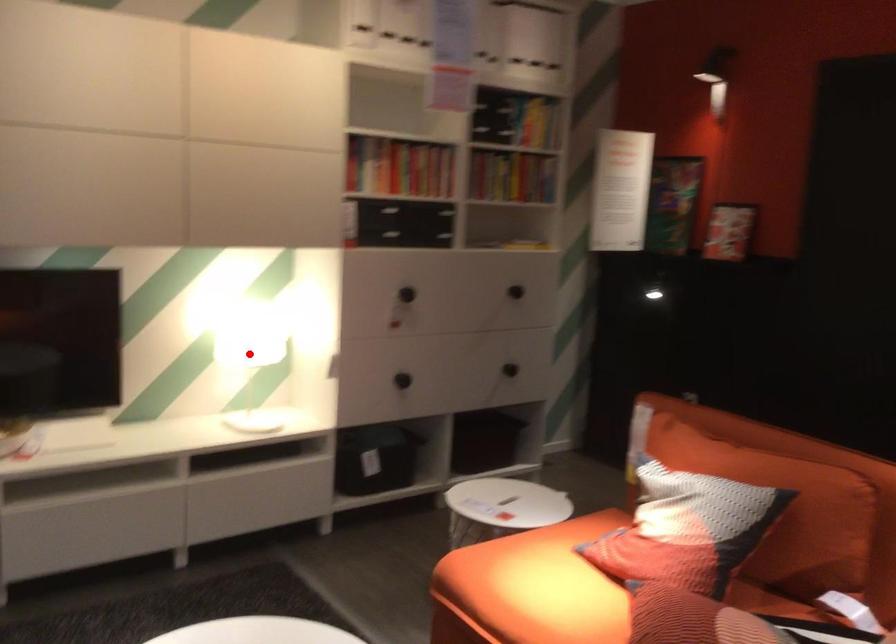
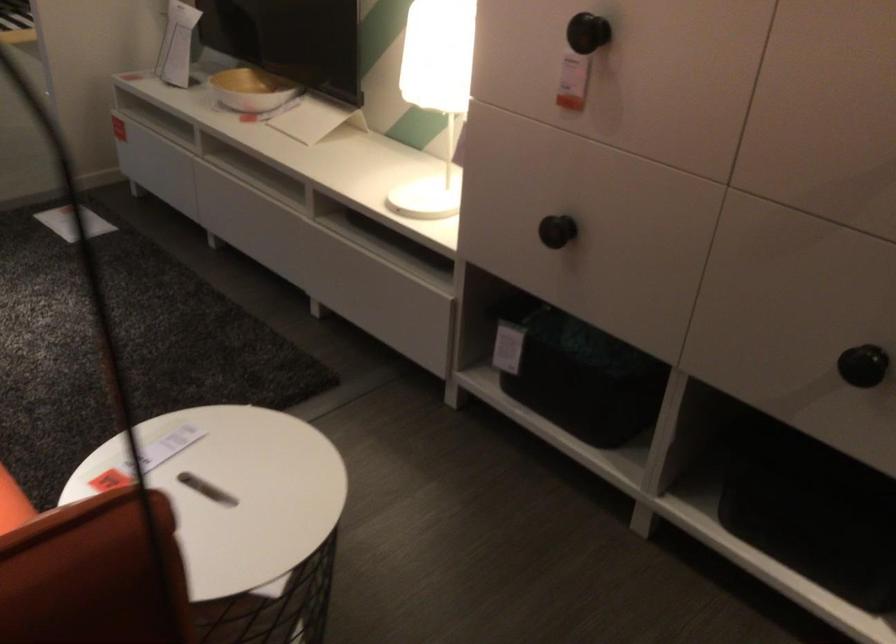
Question: I am providing you with two images of the same scene from different viewpoints. Given a red point in image1, look at the same physical point in image2. Is it:

Choices:
 (A) Closer to the viewpoint
 (B) Farther from the viewpoint

Answer: (A)